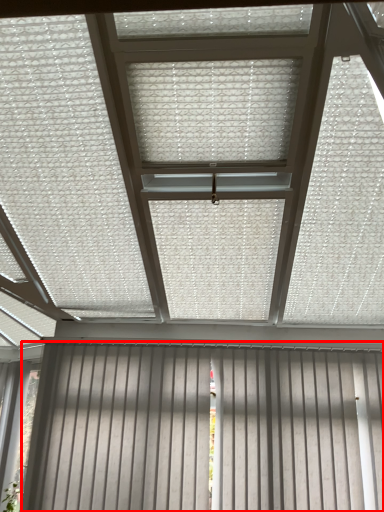
Question: In this image, where is garage door (annotated by the red box) located relative to blind?

Choices:
 (A) left
 (B) right

Answer: (B)